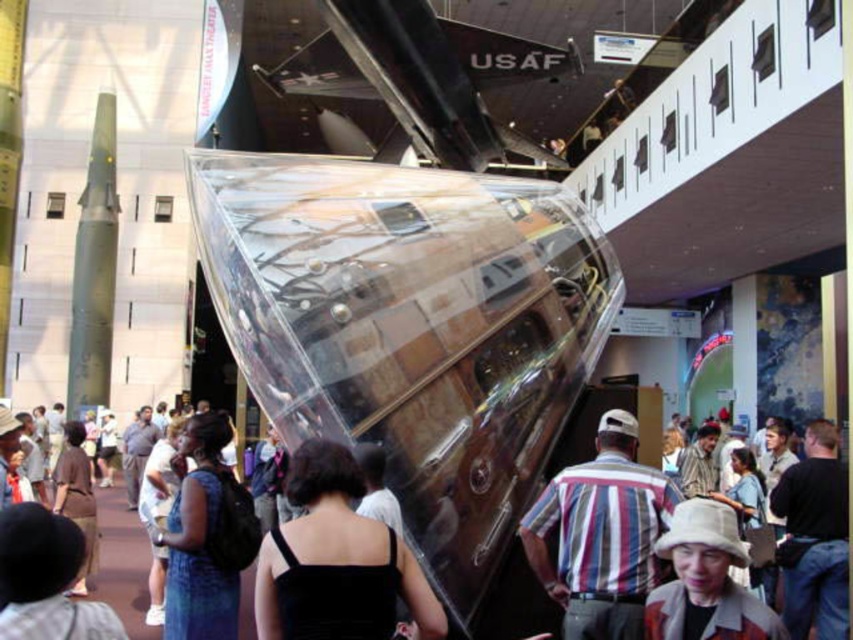
You are standing at the entrance of the museum and see both the black fabric dress at center and the striped cotton shirt at center. If you want to touch both items, which one should you reach for first considering their distances from you?

The striped cotton shirt at center is closer to you since the black fabric dress at center is 10.35 meters away from it. Therefore, you should reach for the striped cotton shirt at center first.

You are an assistant at a fashion exhibit. You need to arrange two items for a display. The items are the black fabric dress at center and the striped cotton shirt at center. According to the current layout, which item is positioned to the left?

The black fabric dress at center is positioned to the left of the striped cotton shirt at center.